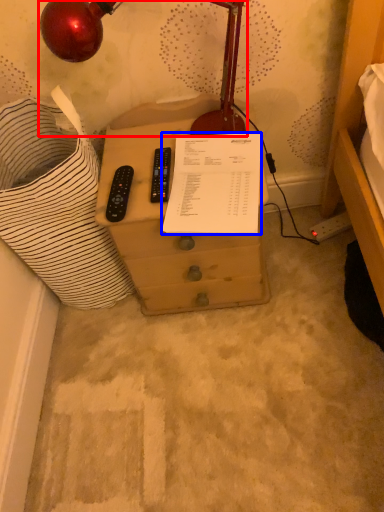
Question: Which of the following is the closest to the observer, lamp (highlighted by a red box) or document (highlighted by a blue box)?

Choices:
 (A) lamp
 (B) document

Answer: (A)